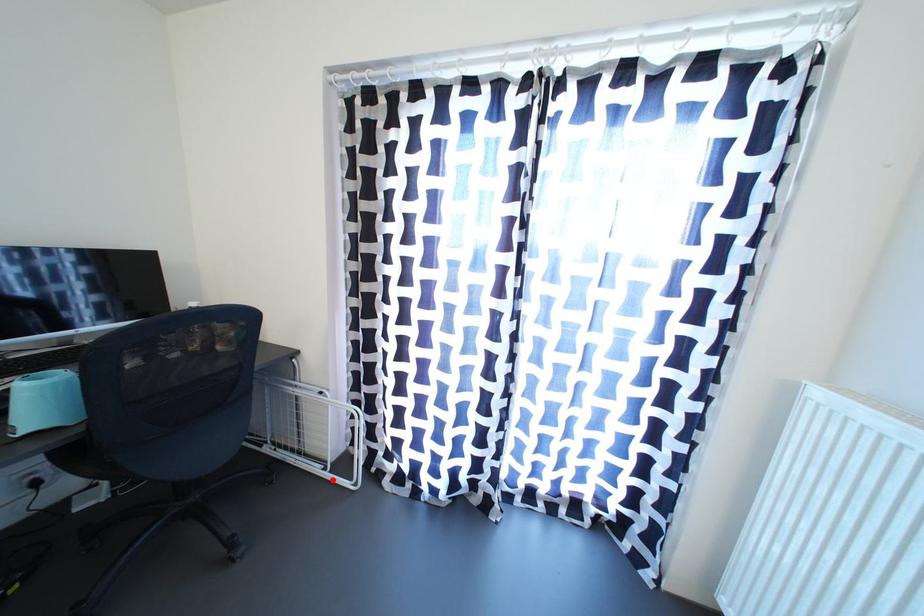
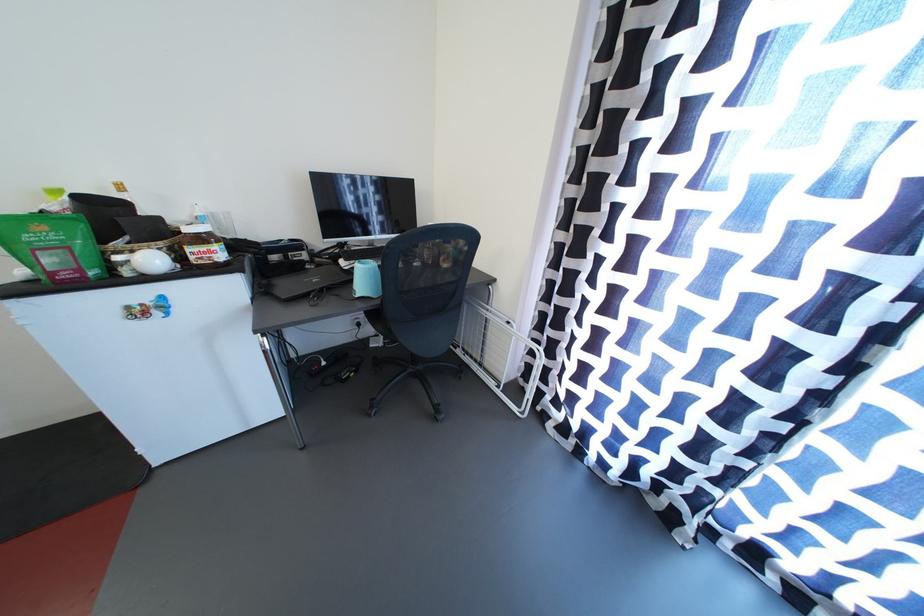
Question: I am providing you with two images of the same scene from different viewpoints. A red point is shown in image1. For the corresponding object point in image2, is it positioned nearer or farther from the camera?

Choices:
 (A) Nearer
 (B) Farther

Answer: (A)